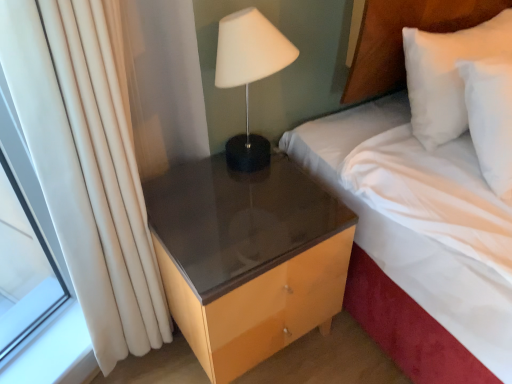
Identify the location of space that is in front of white matte lamp at upper right. The height and width of the screenshot is (384, 512). (253, 203).